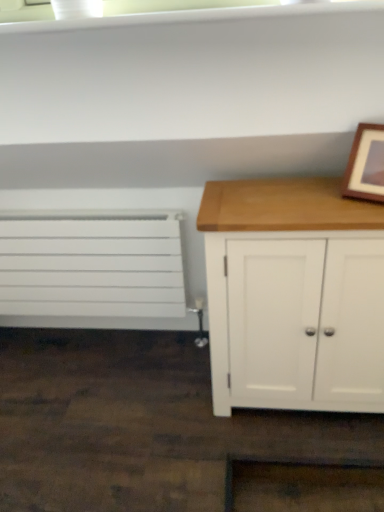
What are the coordinates of `free space to the left of white wood cabinet at right` in the screenshot? It's located at pyautogui.click(x=166, y=415).